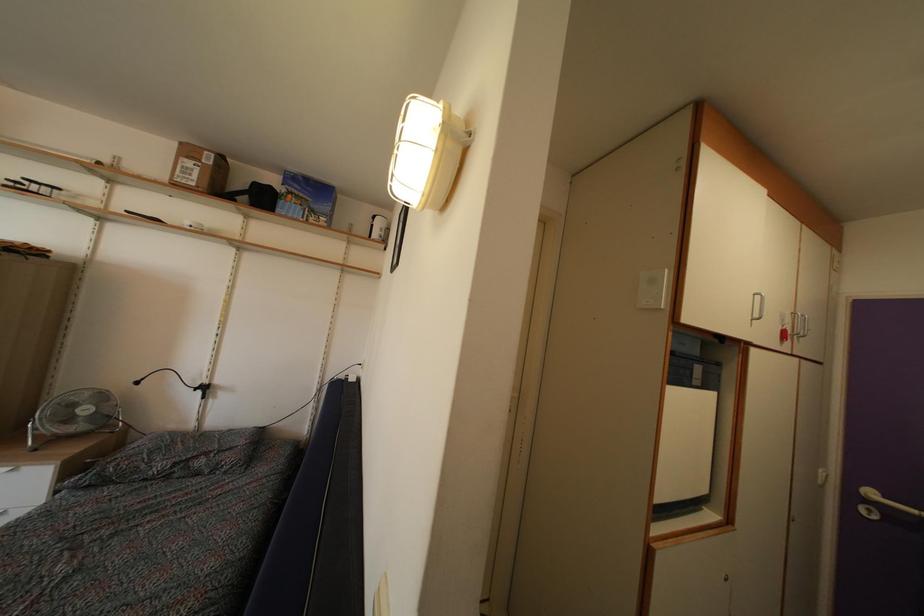
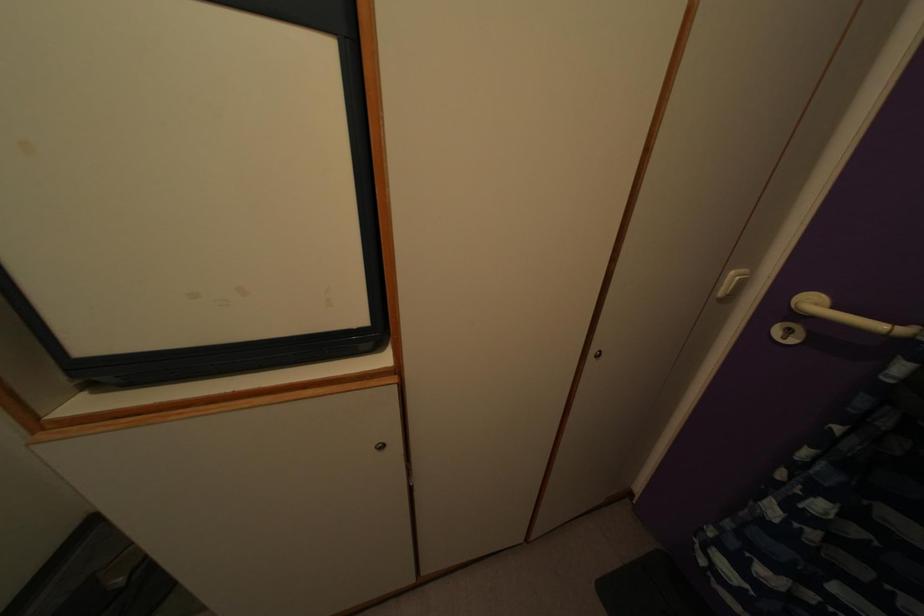
Locate, in the second image, the point that corresponds to (x=873, y=501) in the first image.

(815, 310)